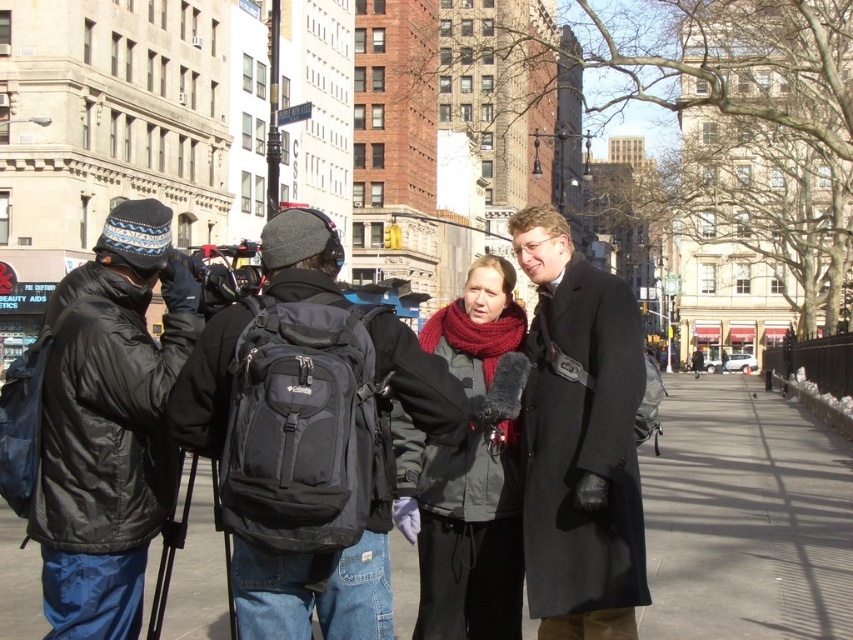
Who is taller, black fabric pavement at center or matte black coat at center?

With more height is matte black coat at center.

In the scene shown: Does black fabric pavement at center have a lesser height compared to matte black coat at center?

Yes, black fabric pavement at center is shorter than matte black coat at center.

Where is `black fabric pavement at center`? black fabric pavement at center is located at coordinates (746, 516).

Does black nylon backpack at center appear on the left side of black matte jacket at left?

In fact, black nylon backpack at center is to the right of black matte jacket at left.

Can you confirm if black nylon backpack at center is positioned below black matte jacket at left?

Indeed, black nylon backpack at center is positioned under black matte jacket at left.

Does point (316, 531) come closer to viewer compared to point (62, 593)?

Yes, it is in front of point (62, 593).

At what (x,y) coordinates should I click in order to perform the action: click on black nylon backpack at center. Please return your answer as a coordinate pair (x, y). This screenshot has width=853, height=640. Looking at the image, I should click on (281, 442).

Between matte black coat at center and dark gray wool scarf at center, which one appears on the right side from the viewer's perspective?

matte black coat at center is more to the right.

How much distance is there between matte black coat at center and dark gray wool scarf at center?

matte black coat at center and dark gray wool scarf at center are 1.46 meters apart from each other.

Where is `matte black coat at center`? The width and height of the screenshot is (853, 640). matte black coat at center is located at coordinates (579, 440).